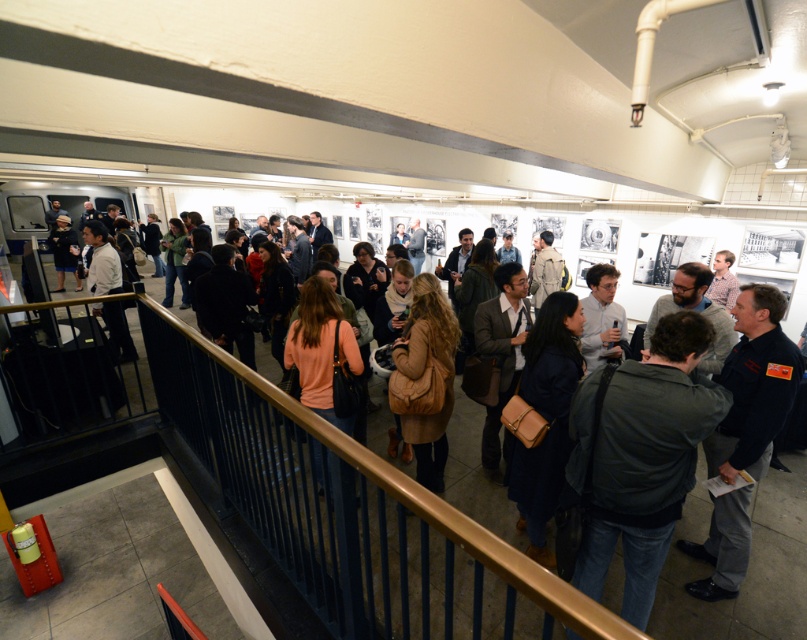
You are at an event and want to greet the person wearing the light gray shirt at center without walking through the crowd. Can you reach them by approaching from behind the dark green jacket at center?

The dark green jacket at center is located below the light gray shirt at center, meaning the light gray shirt at center is positioned higher up. Since you can approach from behind the dark green jacket at center towards the higher position, you can reach the person wearing the light gray shirt at center without going through the crowd.

You are at the coordinates 0.5, 0.5 in the image and want to move to the dark green jacket at center. Which direction should you move in to get closer?

Since the dark green jacket at center is located at point (640, 458), you should move towards the northeast direction to get closer.

You are standing at point [109,260] and want to walk to the exit located at point [615,333]. Is the exit directly in front of you?

Yes, the exit at point [615,333] is directly in front of you because it is positioned in front of your current location at point [109,260].